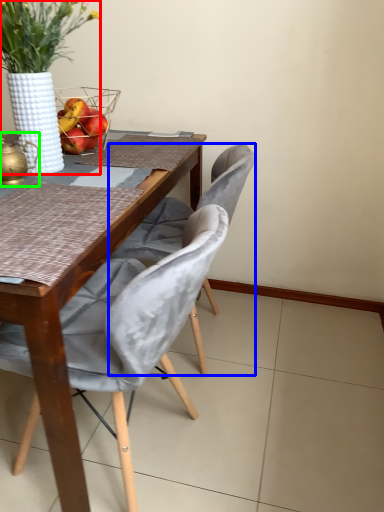
Question: Estimate the real-world distances between objects in this image. Which object is closer to houseplant (highlighted by a red box), chair (highlighted by a blue box) or tea pot (highlighted by a green box)?

Choices:
 (A) chair
 (B) tea pot

Answer: (B)